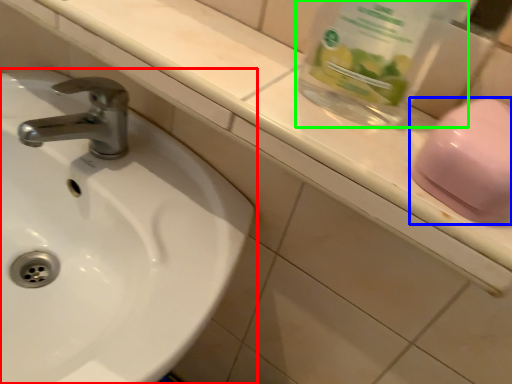
Question: Which is nearer to the sink (highlighted by a red box)? soap (highlighted by a blue box) or glass jar (highlighted by a green box).

Choices:
 (A) soap
 (B) glass jar

Answer: (B)